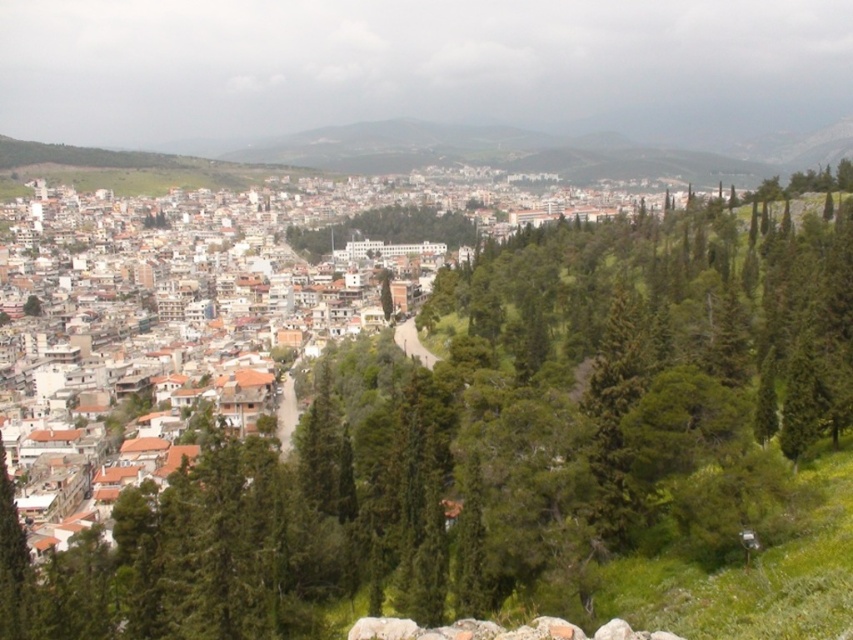
Question: Which point is closer to the camera taking this photo?

Choices:
 (A) (769, 200)
 (B) (383, 228)

Answer: (A)

Question: Observing the image, what is the correct spatial positioning of green leafy tree at center in reference to green leafy trees at center?

Choices:
 (A) above
 (B) below

Answer: (B)

Question: Is the position of green leafy tree at center more distant than that of green leafy trees at center?

Choices:
 (A) no
 (B) yes

Answer: (A)

Question: Which point is farther to the camera?

Choices:
 (A) green leafy trees at center
 (B) green leafy tree at center

Answer: (A)

Question: Does green leafy tree at center appear on the right side of green leafy trees at center?

Choices:
 (A) no
 (B) yes

Answer: (A)